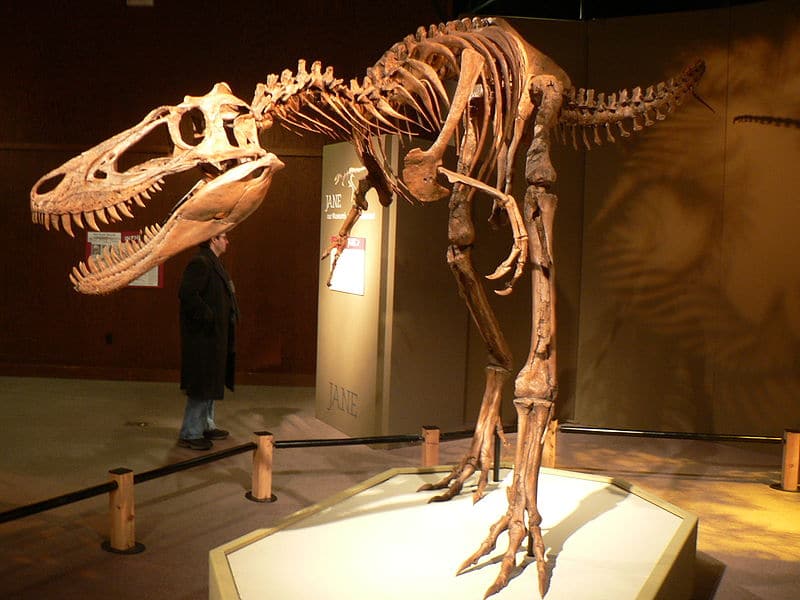
Locate an element on the screen. wall is located at coordinates (662, 222), (266, 246).